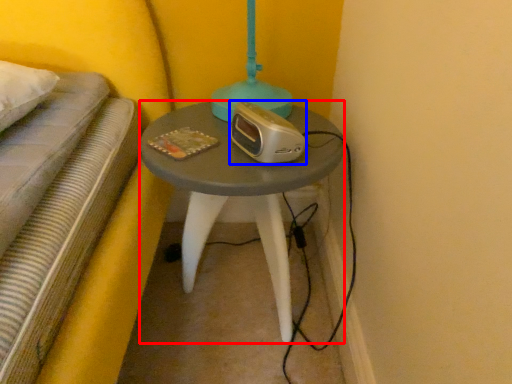
Question: Among these objects, which one is farthest to the camera, table (highlighted by a red box) or appliance (highlighted by a blue box)?

Choices:
 (A) table
 (B) appliance

Answer: (A)